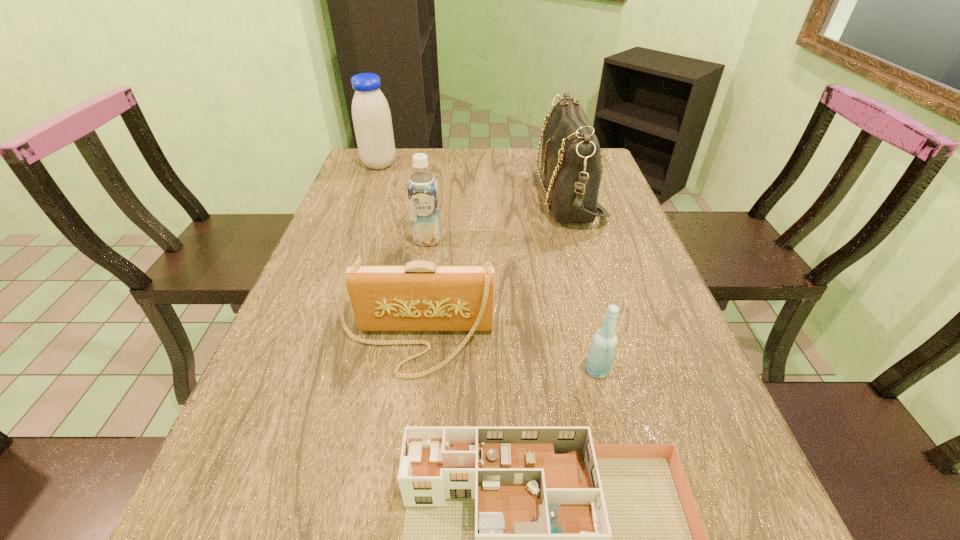
At what (x,y) coordinates should I click in order to perform the action: click on vacant space located 0.150m at the front of the farther handbag with chain and zipper. Please return your answer as a coordinate pair (x, y). Looking at the image, I should click on (489, 195).

Image resolution: width=960 pixels, height=540 pixels. Identify the location of free space located at the front of the farther handbag with chain and zipper. (489, 195).

At what (x,y) coordinates should I click in order to perform the action: click on free location located 0.370m at the front of the farther handbag with chain and zipper. Please return your answer as a coordinate pair (x, y). This screenshot has height=540, width=960. Looking at the image, I should click on (417, 195).

At what (x,y) coordinates should I click in order to perform the action: click on free space located 0.220m on the label of the nearer soya milk. Please return your answer as a coordinate pair (x, y). Image resolution: width=960 pixels, height=540 pixels. Looking at the image, I should click on (418, 307).

Locate an element on the screen. This screenshot has height=540, width=960. vacant space located 0.110m on the decorative side of the nearer handbag is located at coordinates (402, 433).

At what (x,y) coordinates should I click in order to perform the action: click on vacant region located on the back of the bottle. Please return your answer as a coordinate pair (x, y). The height and width of the screenshot is (540, 960). Looking at the image, I should click on (569, 258).

Identify the location of soya milk at the far edge. The width and height of the screenshot is (960, 540). (371, 115).

Where is `handbag present at the far edge`? handbag present at the far edge is located at coordinates (571, 155).

The image size is (960, 540). Identify the location of soya milk that is at the left edge. (371, 115).

I want to click on handbag present at the left edge, so click(420, 296).